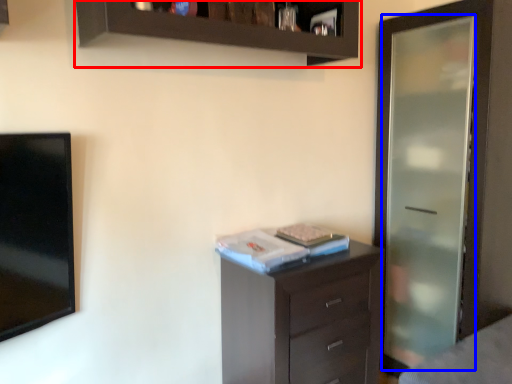
Question: Which object appears closest to the camera in this image, cupboard (highlighted by a red box) or screen door (highlighted by a blue box)?

Choices:
 (A) cupboard
 (B) screen door

Answer: (A)